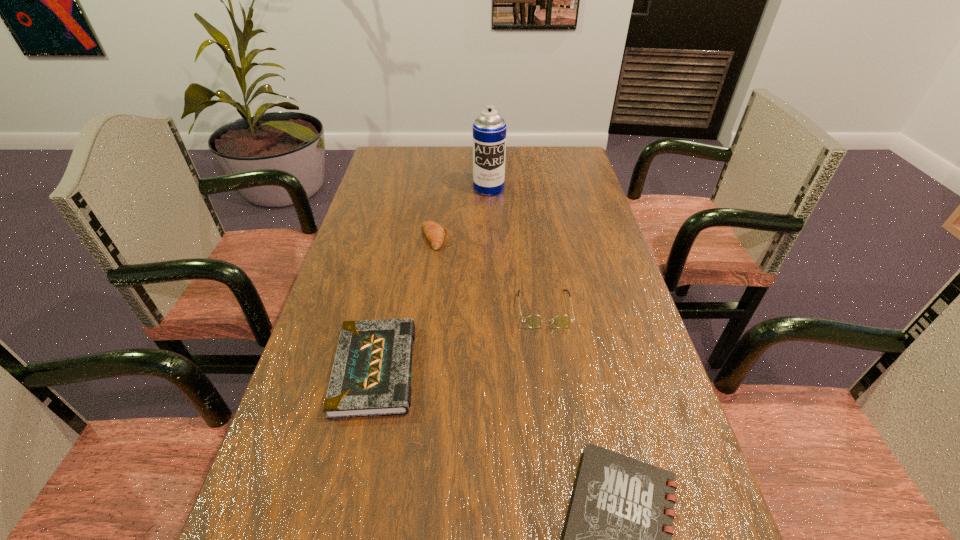
Where is `aerosol can`? aerosol can is located at coordinates (489, 130).

The height and width of the screenshot is (540, 960). Find the location of `the third object from left to right`. the third object from left to right is located at coordinates (489, 130).

At what (x,y) coordinates should I click in order to perform the action: click on spectacles. Please return your answer as a coordinate pair (x, y). The image size is (960, 540). Looking at the image, I should click on (533, 321).

This screenshot has width=960, height=540. Identify the location of crescent roll. (435, 233).

Find the location of a particular element. the farther notebook is located at coordinates (371, 376).

Locate an element on the screen. This screenshot has height=540, width=960. the taller notebook is located at coordinates (371, 376).

The image size is (960, 540). Identify the location of vacant space located on the label side of the tallest object. (490, 229).

Locate an element on the screen. free region located 0.380m on the lenses of the spectacles is located at coordinates (573, 502).

Where is `free region located on the back of the crescent roll`? The width and height of the screenshot is (960, 540). free region located on the back of the crescent roll is located at coordinates (443, 171).

I want to click on vacant space located 0.300m on the right of the left notebook, so coord(558,369).